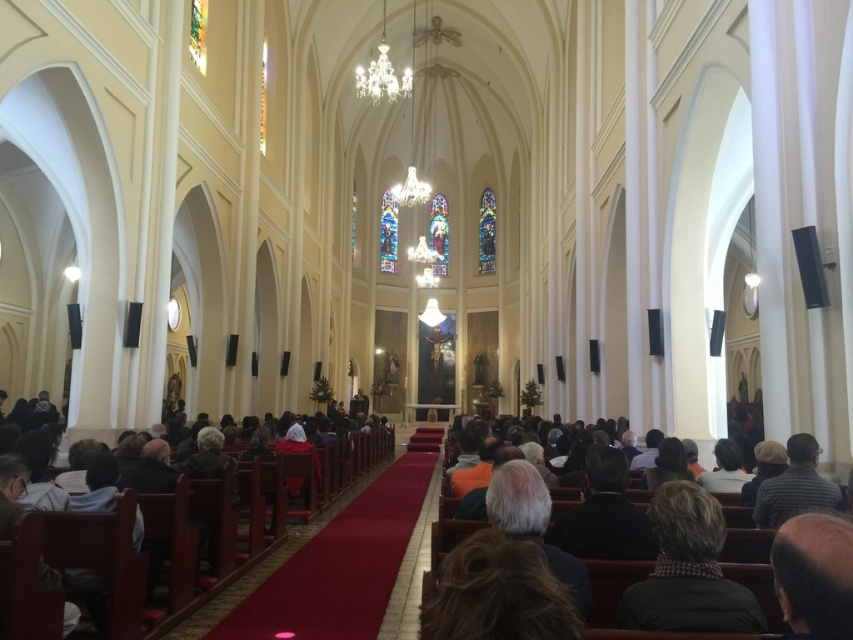
You are standing at the entrance of the church and notice a dark brown leather jacket at center and a dark brown wooden pew at center. Which object is positioned to the right when facing towards the stained glass windows?

The dark brown leather jacket at center is to the right of the dark brown wooden pew at center when facing towards the stained glass windows.

You are a visitor entering the church and see the dark brown leather jacket at center and the dark brown wooden pew at center. Which object is closer to the floor?

The dark brown wooden pew at center is closer to the floor because the dark brown leather jacket at center is shorter than it.

Looking at this image, you are a photographer planning to shoot a closeup of the dark brown wooden pew at center. You have a camera that can focus on objects within 2 meters. You are currently standing at the dark brown leather jacket at lower right. Can you take the photo without moving your position?

The dark brown leather jacket at lower right is thinner than dark brown wooden pew at center, so the distance between them is less than 2 meters. Therefore, you can take the photo without moving your position.